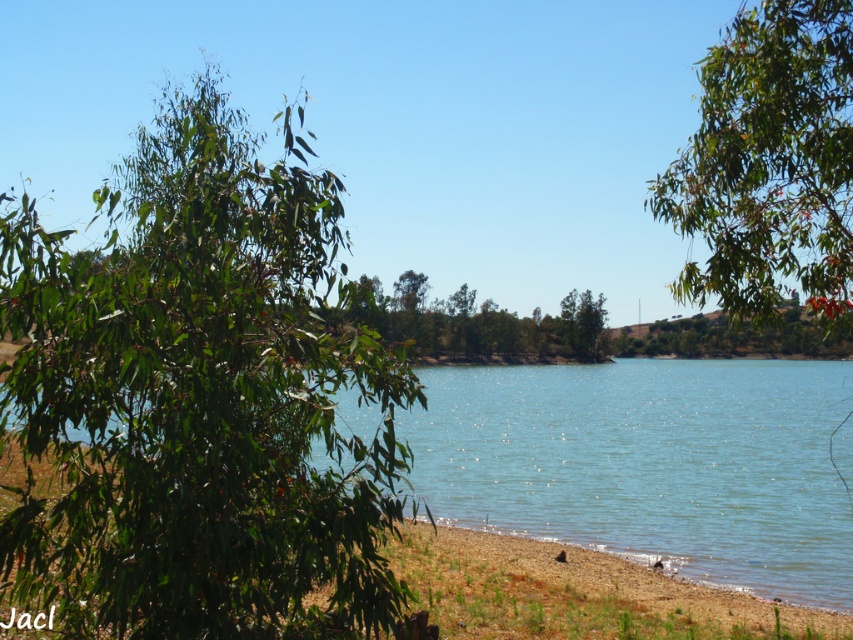
Question: Which point appears farthest from the camera in this image?

Choices:
 (A) (325, 236)
 (B) (573, 314)

Answer: (B)

Question: Is green leafy tree at left closer to the viewer compared to green glossy leaves at upper right?

Choices:
 (A) yes
 (B) no

Answer: (A)

Question: Where is clear blue water at center located in relation to green glossy leaves at upper right in the image?

Choices:
 (A) above
 (B) below

Answer: (B)

Question: Which of the following is the closest to the observer?

Choices:
 (A) green glossy leaves at upper right
 (B) clear blue water at center
 (C) green leafy tree at left

Answer: (C)

Question: Which object is positioned farthest from the green leafy tree at center?

Choices:
 (A) green leafy tree at left
 (B) clear blue water at center

Answer: (B)

Question: Considering the relative positions of green leafy tree at left and green leafy tree at center in the image provided, where is green leafy tree at left located with respect to green leafy tree at center?

Choices:
 (A) right
 (B) left

Answer: (B)